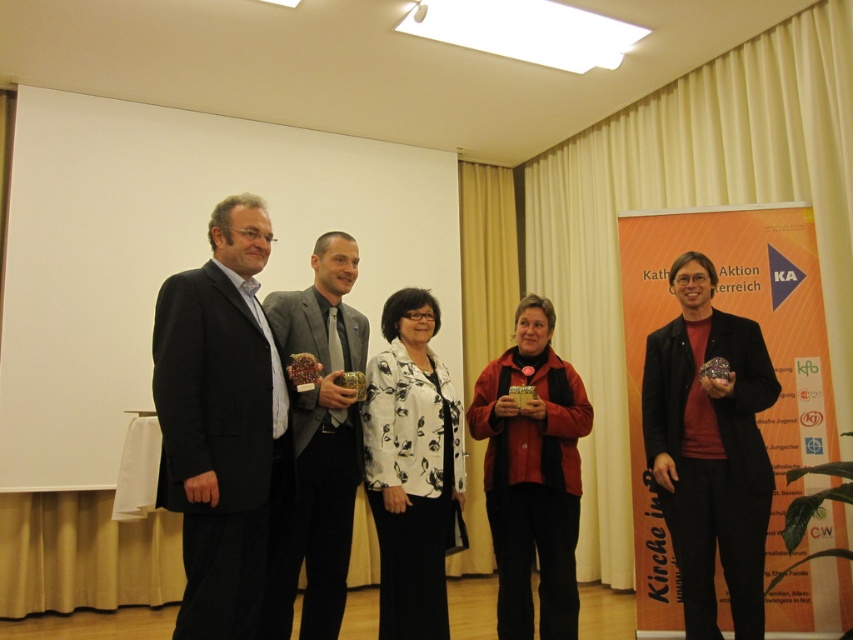
You are a photographer standing at the center of the room. You want to take a closeup of the point at coordinate (532, 474). Which object in the scene should you focus on?

The point at coordinate (532, 474) is on the matte red jacket at center, so you should focus on the matte red jacket at center.

You are standing in the conference room and see two points marked in the image. Which point, point 1 at coordinates (467, 419) or point 2 at coordinates (370, 440), is closer to you?

Point 2 at coordinates (370, 440) is closer to you because it is less far from the camera than point 1 at coordinates (467, 419).